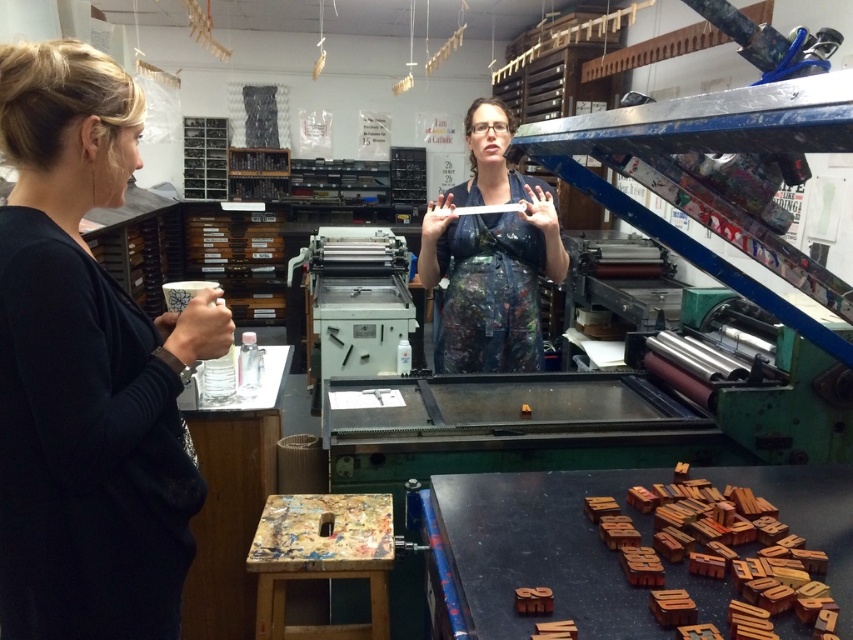
Question: Can you confirm if black fabric shirt at left is positioned to the left of matte black apron at center?

Choices:
 (A) yes
 (B) no

Answer: (A)

Question: Can you confirm if black fabric shirt at left is wider than matte black apron at center?

Choices:
 (A) no
 (B) yes

Answer: (A)

Question: In this image, where is black fabric shirt at left located relative to matte black apron at center?

Choices:
 (A) below
 (B) above

Answer: (A)

Question: Which object appears farthest from the camera in this image?

Choices:
 (A) matte black apron at center
 (B) black fabric shirt at left

Answer: (A)